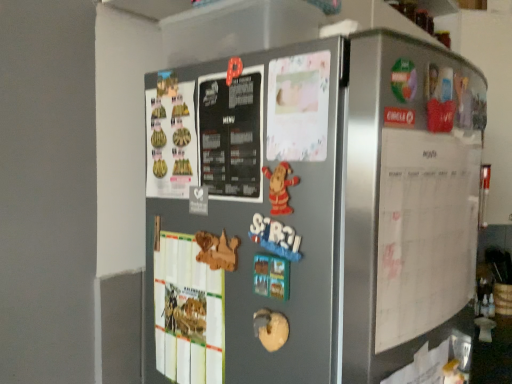
Find the location of `white paper calendar at right`. white paper calendar at right is located at coordinates (425, 231).

This screenshot has height=384, width=512. Describe the element at coordinates (425, 231) in the screenshot. I see `white paper calendar at right` at that location.

Find the location of `satin silver fridge at center`. satin silver fridge at center is located at coordinates (314, 214).

What do you see at coordinates (314, 214) in the screenshot? I see `satin silver fridge at center` at bounding box center [314, 214].

Where is `white paper calendar at right`? The width and height of the screenshot is (512, 384). white paper calendar at right is located at coordinates (425, 231).

Does satin silver fridge at center appear on the left side of white paper calendar at right?

Yes, satin silver fridge at center is to the left of white paper calendar at right.

Does satin silver fridge at center lie in front of white paper calendar at right?

Yes, it is in front of white paper calendar at right.

Which point is more distant from viewer, (183, 102) or (386, 297)?

The point (183, 102) is behind.

From the image's perspective, between satin silver fridge at center and white paper calendar at right, who is located below?

satin silver fridge at center appears lower in the image.

From a real-world perspective, is satin silver fridge at center physically below white paper calendar at right?

Yes, from a real-world perspective, satin silver fridge at center is under white paper calendar at right.

Looking at their sizes, would you say satin silver fridge at center is wider or thinner than white paper calendar at right?

satin silver fridge at center is wider than white paper calendar at right.

In terms of height, does satin silver fridge at center look taller or shorter compared to white paper calendar at right?

Clearly, satin silver fridge at center is taller compared to white paper calendar at right.

Is satin silver fridge at center bigger than white paper calendar at right?

Yes.

Is satin silver fridge at center positioned beyond the bounds of white paper calendar at right?

Absolutely, satin silver fridge at center is external to white paper calendar at right.

Is satin silver fridge at center in contact with white paper calendar at right?

satin silver fridge at center is not next to white paper calendar at right, and they're not touching.

Is satin silver fridge at center facing towards white paper calendar at right?

No.

Where is `refrigerator on the left of the white paper calendar at right`? This screenshot has height=384, width=512. refrigerator on the left of the white paper calendar at right is located at coordinates click(x=314, y=214).

Between white paper calendar at right and satin silver fridge at center, which one appears on the left side from the viewer's perspective?

satin silver fridge at center.

Which object is more forward, white paper calendar at right or satin silver fridge at center?

Positioned in front is satin silver fridge at center.

Considering the positions of points (394, 330) and (421, 326), is point (394, 330) closer to camera compared to point (421, 326)?

Yes, point (394, 330) is in front of point (421, 326).

From the image's perspective, would you say white paper calendar at right is shown under satin silver fridge at center?

Incorrect, from the image's perspective, white paper calendar at right is higher than satin silver fridge at center.

From a real-world perspective, is white paper calendar at right located higher than satin silver fridge at center?

Yes.

Is white paper calendar at right wider or thinner than satin silver fridge at center?

In the image, white paper calendar at right appears to be more narrow than satin silver fridge at center.

Considering the sizes of objects white paper calendar at right and satin silver fridge at center in the image provided, who is taller, white paper calendar at right or satin silver fridge at center?

satin silver fridge at center is taller.

Which of these two, white paper calendar at right or satin silver fridge at center, is bigger?

Bigger between the two is satin silver fridge at center.

Is white paper calendar at right positioned beyond the bounds of satin silver fridge at center?

Absolutely, white paper calendar at right is external to satin silver fridge at center.

Are white paper calendar at right and satin silver fridge at center making contact?

No, white paper calendar at right is not making contact with satin silver fridge at center.

Is white paper calendar at right oriented towards satin silver fridge at center?

No, white paper calendar at right is not oriented towards satin silver fridge at center.

Can you tell me how much white paper calendar at right and satin silver fridge at center differ in facing direction?

The angular difference between white paper calendar at right and satin silver fridge at center is 85 degrees.

This screenshot has height=384, width=512. I want to click on refrigerator in front of the white paper calendar at right, so click(314, 214).

Locate an element on the screen. menu above the satin silver fridge at center (from a real-world perspective) is located at coordinates (425, 231).

Locate an element on the screen. menu behind the satin silver fridge at center is located at coordinates (425, 231).